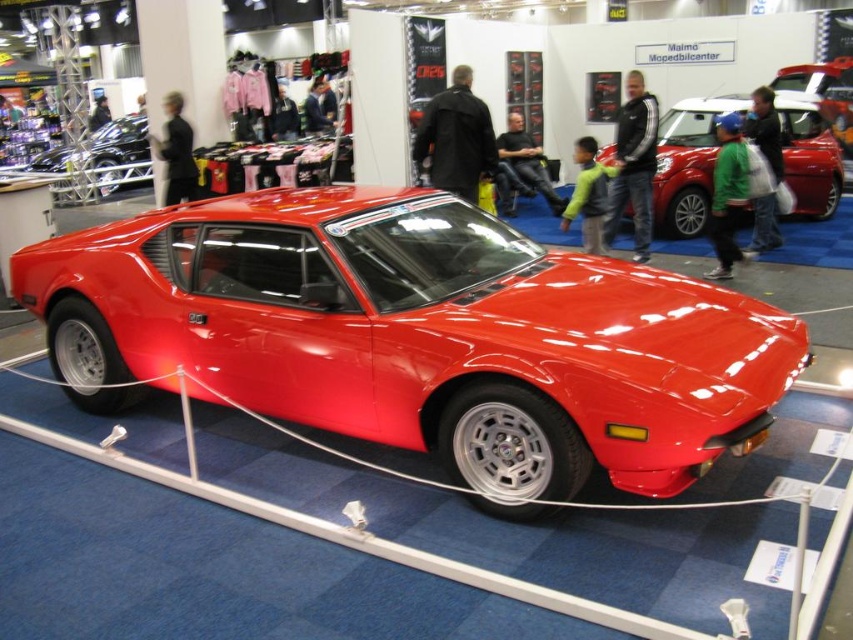
Does glossy red sports car at center lie in front of shiny red car at center?

Yes, glossy red sports car at center is closer to the viewer.

Is glossy red sports car at center thinner than shiny red car at center?

In fact, glossy red sports car at center might be wider than shiny red car at center.

This screenshot has height=640, width=853. What do you see at coordinates (416, 336) in the screenshot? I see `glossy red sports car at center` at bounding box center [416, 336].

This screenshot has height=640, width=853. I want to click on glossy red sports car at center, so click(x=416, y=336).

You are a GUI agent. You are given a task and a screenshot of the screen. Output one action in this format:
    pyautogui.click(x=<x>, y=<y>)
    Task: Click on the shiny red car at center
    
    Given the screenshot: What is the action you would take?
    pyautogui.click(x=688, y=163)

Is shiny red car at center wider than shiny black car at left?

No.

Is point (660, 228) positioned in front of point (120, 122)?

Yes, point (660, 228) is in front of point (120, 122).

The height and width of the screenshot is (640, 853). In order to click on shiny red car at center in this screenshot , I will do `click(688, 163)`.

Who is shorter, glossy red sports car at center or shiny black car at left?

glossy red sports car at center

Can you confirm if glossy red sports car at center is positioned below shiny black car at left?

Correct, glossy red sports car at center is located below shiny black car at left.

Is point (692, 412) more distant than point (94, 147)?

That is False.

At what (x,y) coordinates should I click in order to perform the action: click on glossy red sports car at center. Please return your answer as a coordinate pair (x, y). Looking at the image, I should click on (416, 336).